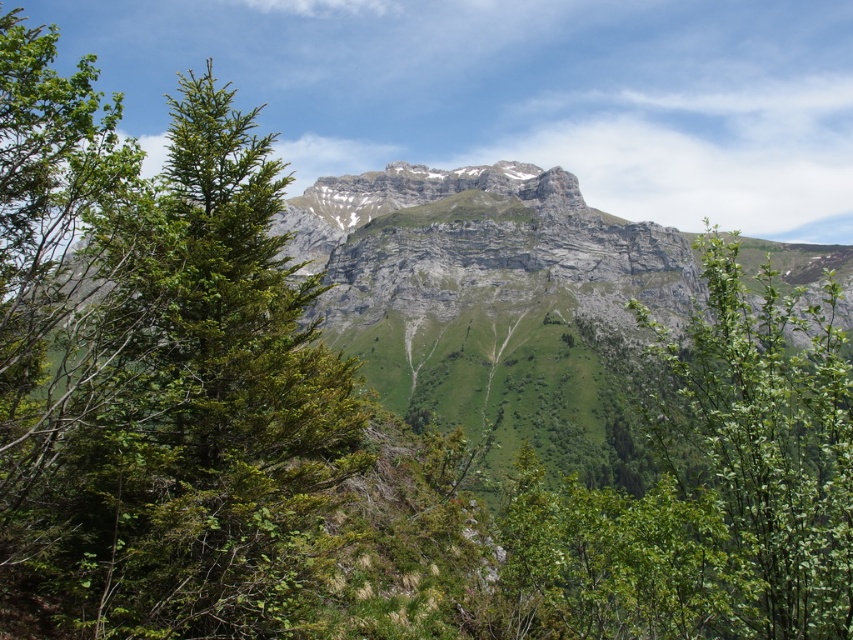
Which is more to the left, gray rocky mountain range at center or green leafy shrub at center?

gray rocky mountain range at center

Find the location of a particular element. The width and height of the screenshot is (853, 640). gray rocky mountain range at center is located at coordinates (492, 300).

Is point (543, 257) closer to camera compared to point (814, 358)?

No, (543, 257) is further to viewer.

Find the location of a particular element. The image size is (853, 640). gray rocky mountain range at center is located at coordinates (492, 300).

Which of these two, green needle-like tree at center-left or gray rocky mountain range at center, stands taller?

green needle-like tree at center-left

Locate an element on the screen. This screenshot has width=853, height=640. green needle-like tree at center-left is located at coordinates (193, 410).

Which is in front, point (108, 328) or point (308, 241)?

Point (108, 328)

Locate an element on the screen. green needle-like tree at center-left is located at coordinates (193, 410).

Is point (117, 230) in front of point (506, 520)?

Yes, point (117, 230) is closer to viewer.

Is green needle-like tree at center-left thinner than green leafy shrub at center?

Correct, green needle-like tree at center-left's width is less than green leafy shrub at center's.

Measure the distance between green needle-like tree at center-left and camera.

The distance of green needle-like tree at center-left from camera is 220.75 feet.

Locate an element on the screen. green needle-like tree at center-left is located at coordinates [x=193, y=410].